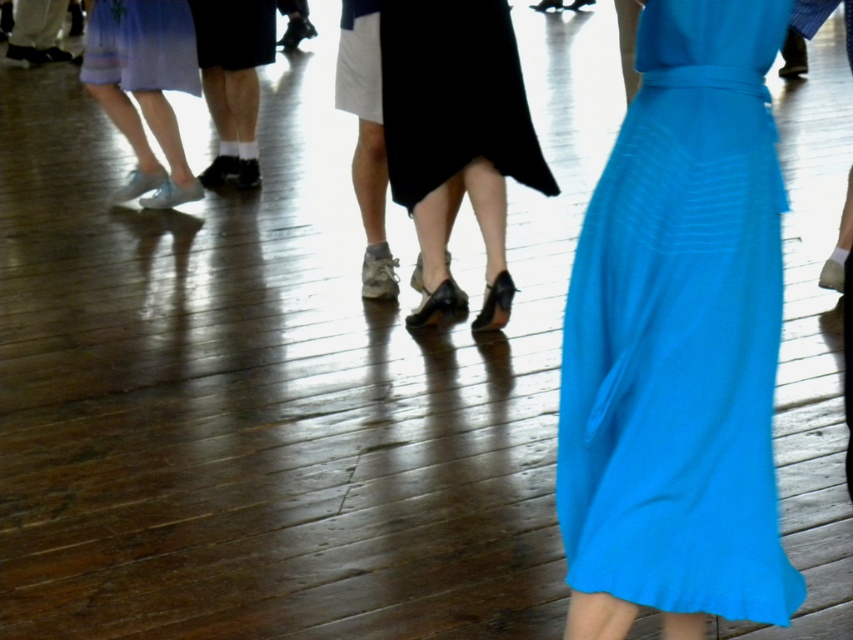
Question: Which object appears farthest from the camera in this image?

Choices:
 (A) black satin skirt at center
 (B) matte white sneakers at lower left

Answer: (B)

Question: Which point is closer to the camera?

Choices:
 (A) matte blue dress at center
 (B) matte blue dress at upper left

Answer: (A)

Question: Does black satin skirt at center have a lesser width compared to matte blue dress at upper left?

Choices:
 (A) no
 (B) yes

Answer: (A)

Question: Is black satin skirt at center bigger than matte blue dress at upper left?

Choices:
 (A) yes
 (B) no

Answer: (A)

Question: Can you confirm if matte white sneakers at lower left is wider than matte black skirt at center?

Choices:
 (A) no
 (B) yes

Answer: (B)

Question: Which point is farther from the camera taking this photo?

Choices:
 (A) (236, 96)
 (B) (125, 83)

Answer: (A)